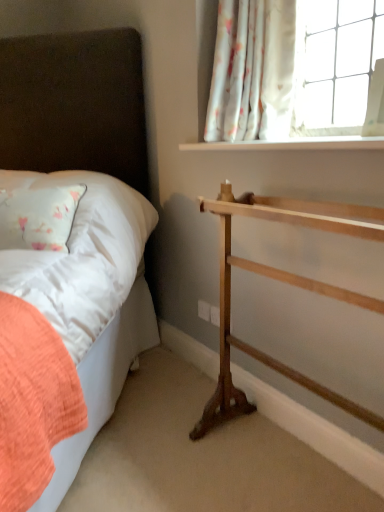
Question: Is there a large distance between natural wood towel rack at right and white smooth window sill at upper right?

Choices:
 (A) no
 (B) yes

Answer: (A)

Question: Is natural wood towel rack at right closer to the viewer compared to white smooth window sill at upper right?

Choices:
 (A) no
 (B) yes

Answer: (B)

Question: Is white smooth window sill at upper right completely or partially inside natural wood towel rack at right?

Choices:
 (A) no
 (B) yes

Answer: (A)

Question: Can you confirm if natural wood towel rack at right is positioned to the right of white smooth window sill at upper right?

Choices:
 (A) yes
 (B) no

Answer: (B)

Question: Is natural wood towel rack at right oriented away from white smooth window sill at upper right?

Choices:
 (A) no
 (B) yes

Answer: (A)

Question: Is natural wood towel rack at right located outside white smooth window sill at upper right?

Choices:
 (A) no
 (B) yes

Answer: (B)

Question: Can you confirm if white floral fabric at upper right is thinner than natural wood towel rack at right?

Choices:
 (A) yes
 (B) no

Answer: (A)

Question: Is natural wood towel rack at right located within white floral fabric at upper right?

Choices:
 (A) no
 (B) yes

Answer: (A)

Question: Is white floral fabric at upper right shorter than natural wood towel rack at right?

Choices:
 (A) no
 (B) yes

Answer: (B)

Question: Can you confirm if white floral fabric at upper right is positioned to the left of natural wood towel rack at right?

Choices:
 (A) no
 (B) yes

Answer: (B)

Question: Can you confirm if white floral fabric at upper right is wider than natural wood towel rack at right?

Choices:
 (A) no
 (B) yes

Answer: (A)

Question: From the image's perspective, does white floral fabric at upper right appear higher than natural wood towel rack at right?

Choices:
 (A) no
 (B) yes

Answer: (B)

Question: From the image's perspective, is natural wood towel rack at right located beneath matte white bed at left?

Choices:
 (A) yes
 (B) no

Answer: (A)